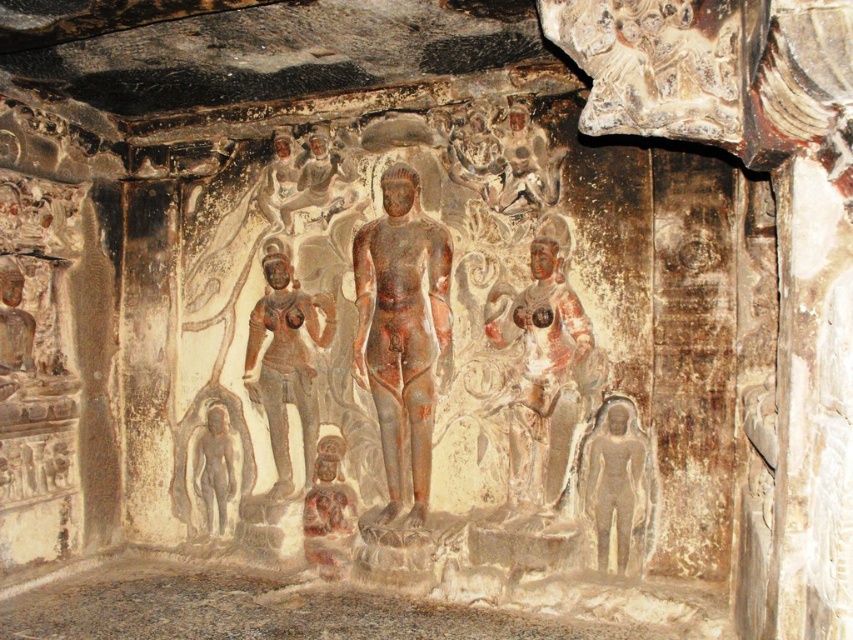
You are standing in front of the stone relief and want to touch the point at coordinate (546, 461). If your arm can reach up to 2 meters, can you reach that point?

The point at coordinate (546, 461) is 3.18 meters away from the camera, which is farther than your arm can reach. You cannot reach it with your arm extended to 2 meters.